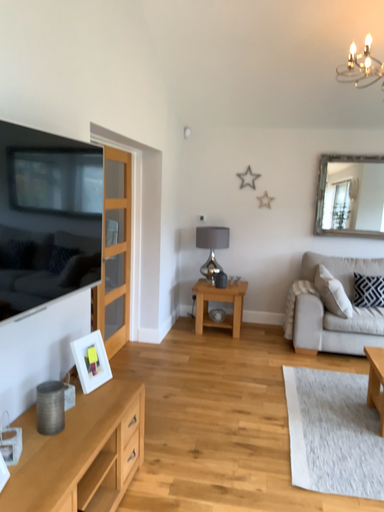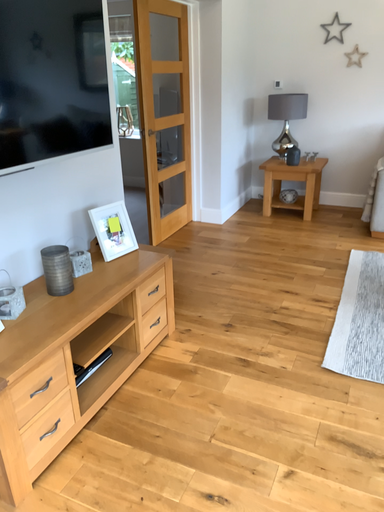
Question: Which way did the camera rotate in the video?

Choices:
 (A) rotated left
 (B) rotated right

Answer: (A)